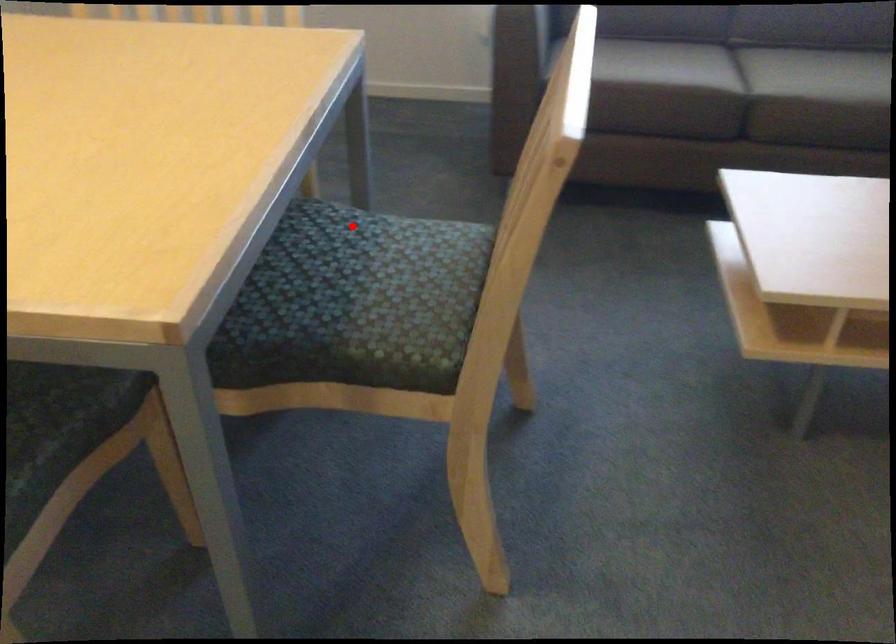
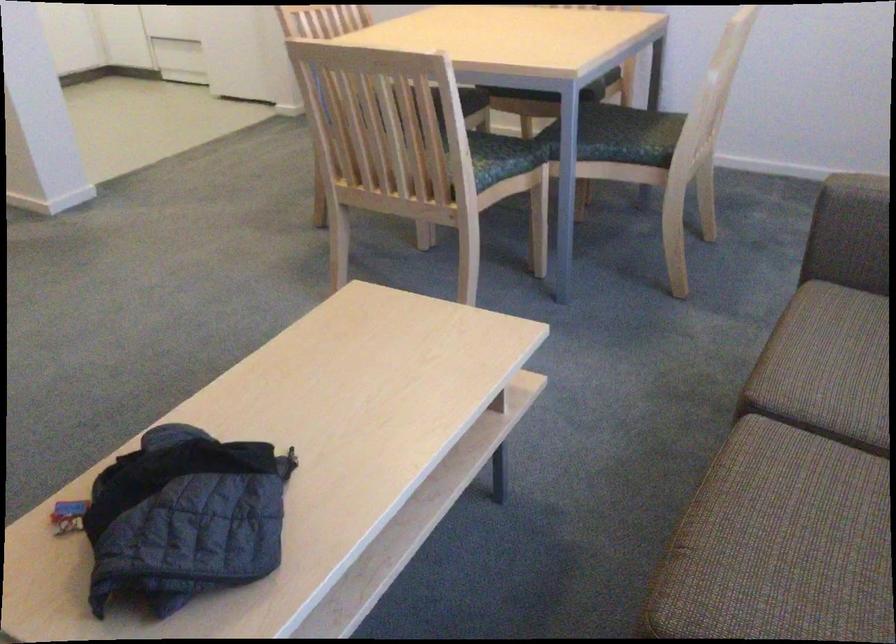
Find the pixel in the second image that matches the highlighted location in the first image.

(501, 158)